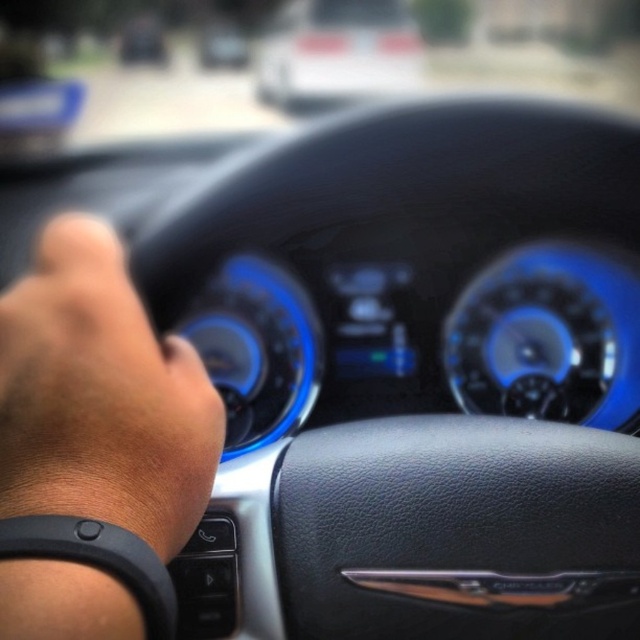
You are a passenger in the car and want to see the digital display screen between the two dials on the dashboard. Which object, the dark skin wristband at lower left or the matte black steering wheel at center, is closer to you?

The dark skin wristband at lower left is closer to the viewer than the matte black steering wheel at center, so it is closer to you.

You are a passenger in the car and you see the dark skin wristband at lower left represented by point (100, 396). Is there any object near that point that could be a potential distraction for the driver?

The dark skin wristband at lower left is represented by point (100, 396). There is no object near that point mentioned in the scene description that could be a potential distraction for the driver.

You are a passenger in the car and want to point out the white glossy car at upper center and the matte black steering wheel at center to a friend. Which one is bigger in the image?

Result: The white glossy car at upper center is bigger in the image compared to the matte black steering wheel at center.